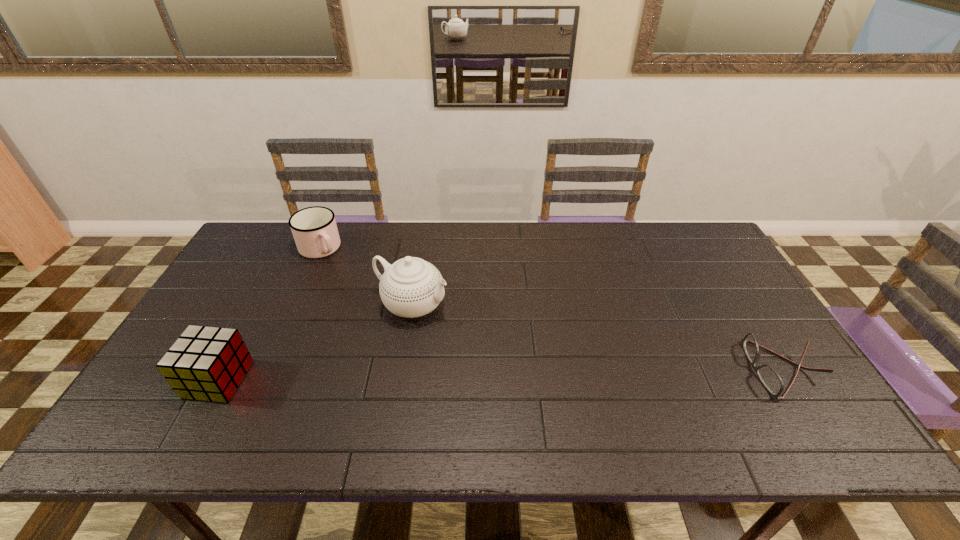
The image size is (960, 540). In order to click on vacant spot on the desktop that is between the cube and the shortest object and is positioned on the spout of the second object from right to left in this screenshot , I will do `click(576, 373)`.

This screenshot has width=960, height=540. What are the coordinates of `free space on the desktop that is between the cube and the rightmost object and is positioned on the side of the mug with the handle` in the screenshot? It's located at (430, 376).